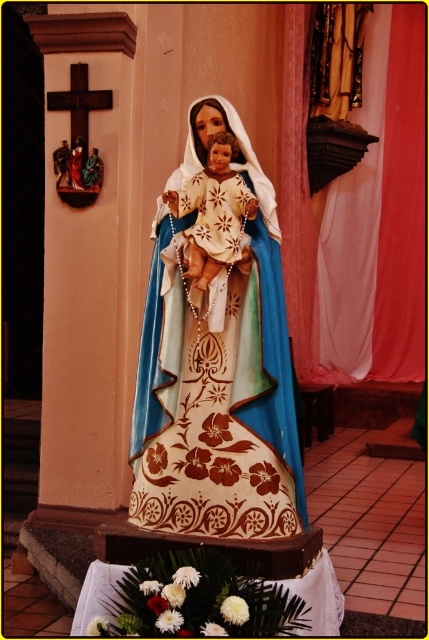
Question: Which point is closer to the camera?

Choices:
 (A) pyautogui.click(x=274, y=381)
 (B) pyautogui.click(x=57, y=173)
 (C) pyautogui.click(x=199, y=268)

Answer: (A)

Question: Among these points, which one is farthest from the camera?

Choices:
 (A) (190, 273)
 (B) (85, 168)
 (C) (65, 170)
 (D) (239, 538)

Answer: (C)

Question: Does painted wood statue at center appear under wooden statue at left?

Choices:
 (A) no
 (B) yes

Answer: (B)

Question: Considering the relative positions of matte painted wood doll at center and wooden statue at left in the image provided, where is matte painted wood doll at center located with respect to wooden statue at left?

Choices:
 (A) right
 (B) left

Answer: (A)

Question: Is painted wood statue at center wider than wooden statue at left?

Choices:
 (A) no
 (B) yes

Answer: (B)

Question: Based on their relative distances, which object is farther from the wooden statue at left?

Choices:
 (A) wooden statue at center
 (B) painted wood statue at center

Answer: (B)